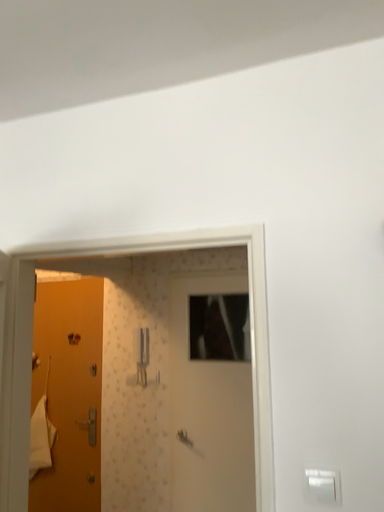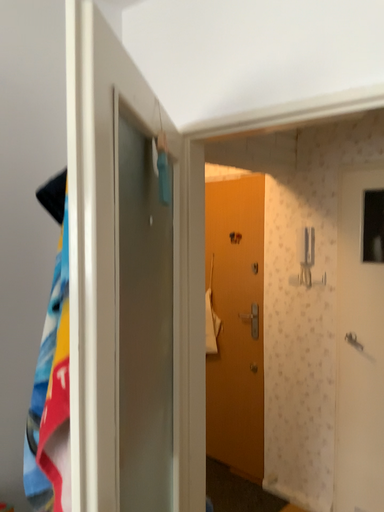
Question: Which way did the camera rotate in the video?

Choices:
 (A) rotated right
 (B) rotated left

Answer: (B)